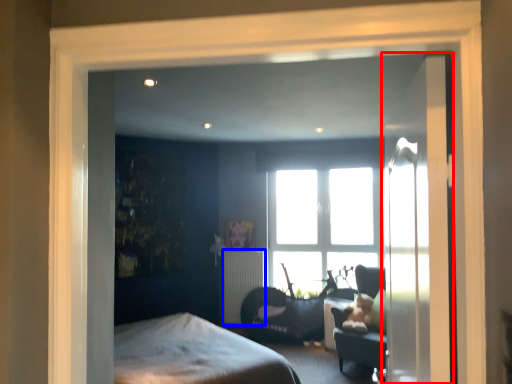
Question: Among these objects, which one is farthest to the camera, door (highlighted by a red box) or radiator (highlighted by a blue box)?

Choices:
 (A) door
 (B) radiator

Answer: (B)